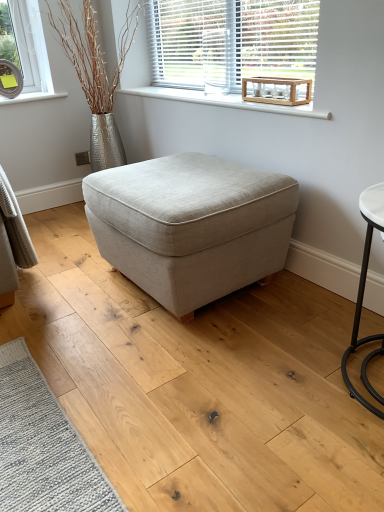
This screenshot has width=384, height=512. I want to click on vacant area to the left of beige fabric ottoman at center, so click(x=60, y=295).